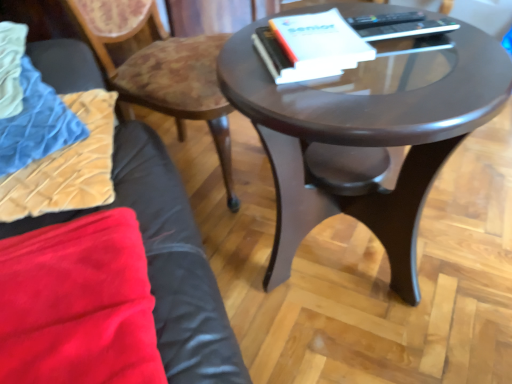
Question: Is glossy dark wood coffee table at center spatially inside wooden textured chair at upper left, or outside of it?

Choices:
 (A) inside
 (B) outside

Answer: (B)

Question: From a real-world perspective, is glossy dark wood coffee table at center above or below wooden textured chair at upper left?

Choices:
 (A) below
 (B) above

Answer: (A)

Question: Based on their relative distances, which object is farther from the velvet beige pillow at lower left?

Choices:
 (A) velvet blue blanket at left
 (B) wooden textured chair at upper left
 (C) white paper at center
 (D) glossy dark wood coffee table at center

Answer: (C)

Question: Based on their relative distances, which object is nearer to the white paper at center?

Choices:
 (A) velvet beige pillow at lower left
 (B) glossy dark wood coffee table at center
 (C) velvet blue blanket at left
 (D) wooden textured chair at upper left

Answer: (B)